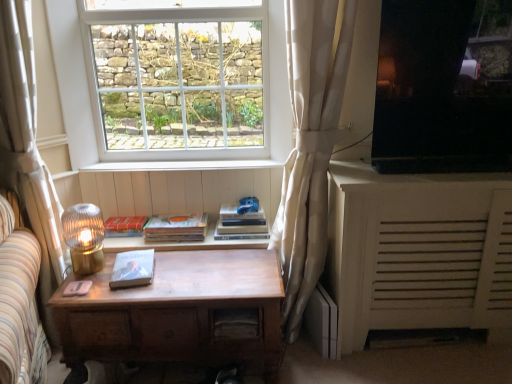
Find the location of a particular element. Image resolution: width=512 pixels, height=384 pixels. vacant area that is in front of matte white paperback book at center, marked as the 1th paperback book in a front-to-back arrangement is located at coordinates (118, 293).